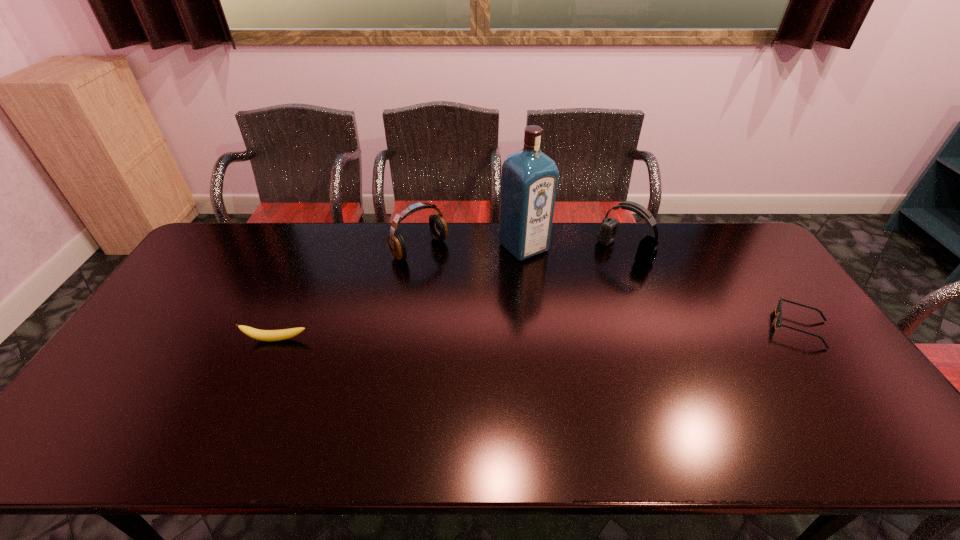
Locate an element on the screen. Image resolution: width=960 pixels, height=540 pixels. the leftmost object is located at coordinates (263, 335).

The width and height of the screenshot is (960, 540). Find the location of `the fourth tallest object`. the fourth tallest object is located at coordinates (263, 335).

What are the coordinates of `the shortest object` in the screenshot? It's located at 778,323.

At what (x,y) coordinates should I click in order to perform the action: click on the rightmost object. Please return your answer as a coordinate pair (x, y). Looking at the image, I should click on (778, 323).

This screenshot has height=540, width=960. In order to click on the left headset in this screenshot , I will do `click(438, 228)`.

At what (x,y) coordinates should I click in order to perform the action: click on the tallest object. Please return your answer as a coordinate pair (x, y). Looking at the image, I should click on (529, 179).

What are the coordinates of `liquor` in the screenshot? It's located at (529, 179).

Where is `the fourth object from left to right`? This screenshot has width=960, height=540. the fourth object from left to right is located at coordinates (647, 249).

Identify the location of free space located on the upward curve of the banana. (254, 390).

The height and width of the screenshot is (540, 960). Find the location of `vacant space situated 0.370m on the lenses of the rightmost object`. vacant space situated 0.370m on the lenses of the rightmost object is located at coordinates (640, 327).